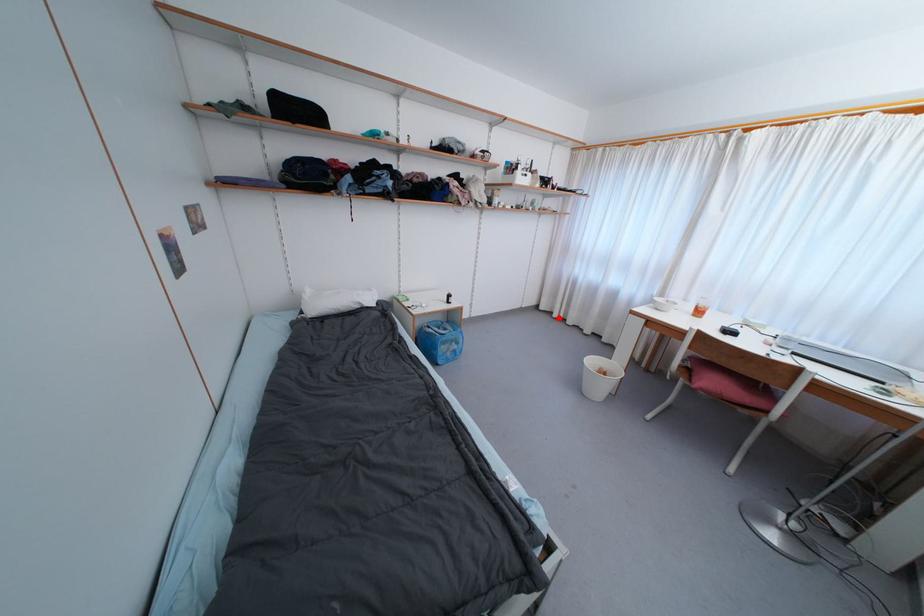
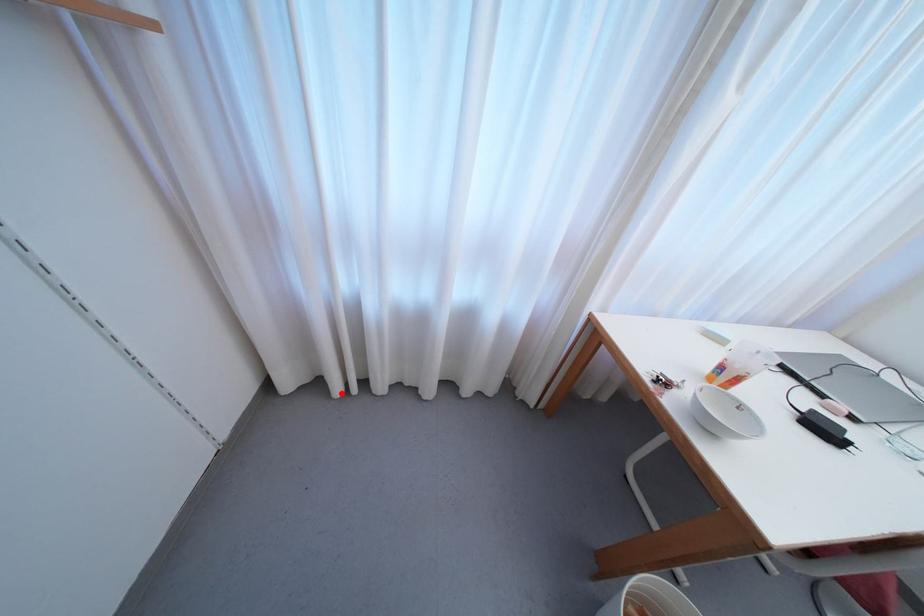
I am providing you with two images of the same scene from different viewpoints. A red point is marked on the first image and another point is marked on the second image. Is the marked point in image1 the same physical position as the marked point in image2?

Yes